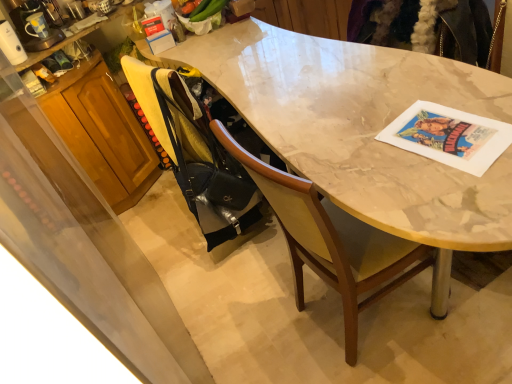
I want to click on vacant region above marble table at center (from a real-world perspective), so click(307, 85).